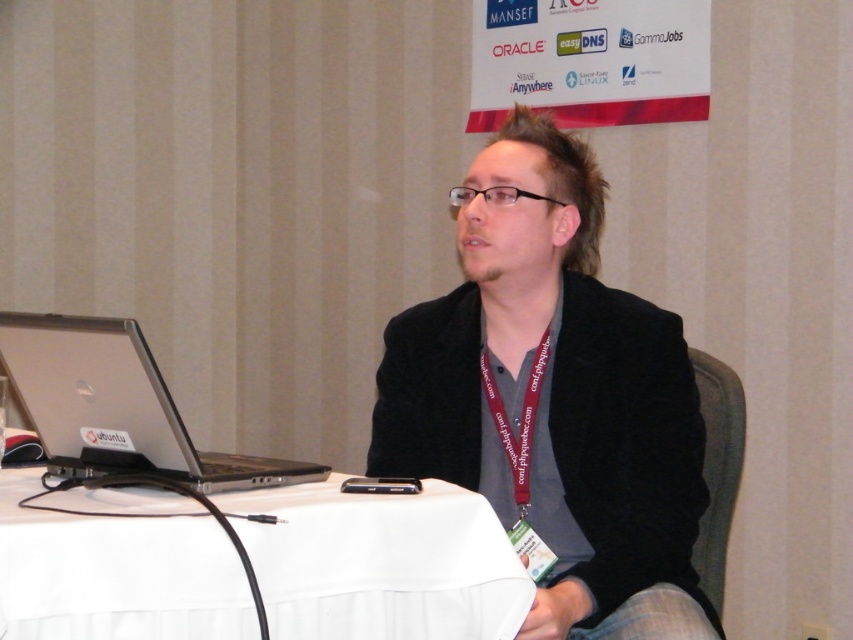
Question: Among these objects, which one is farthest from the camera?

Choices:
 (A) white fabric table at lower left
 (B) burgundy fabric lanyard at center

Answer: (B)

Question: Which of the following is the closest to the observer?

Choices:
 (A) (714, 433)
 (B) (477, 272)
 (C) (495, 422)

Answer: (B)

Question: Is black fabric jacket at center to the right of white fabric table at lower left from the viewer's perspective?

Choices:
 (A) yes
 (B) no

Answer: (A)

Question: Is black fabric jacket at center positioned in front of gray fabric chair at right?

Choices:
 (A) no
 (B) yes

Answer: (B)

Question: Does white fabric table at lower left lie in front of silver metallic laptop at left?

Choices:
 (A) yes
 (B) no

Answer: (A)

Question: Which point is farther to the camera?

Choices:
 (A) white fabric table at lower left
 (B) burgundy fabric lanyard at center
 (C) black fabric jacket at center
 (D) silver metallic laptop at left

Answer: (B)